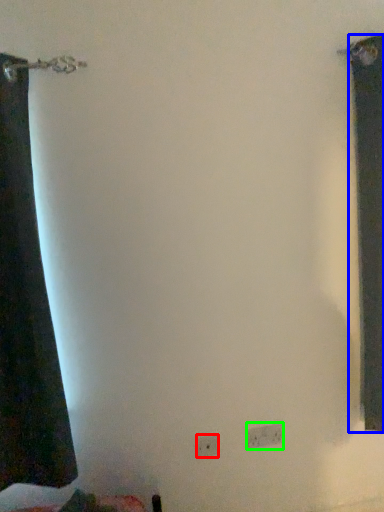
Question: Based on their relative distances, which object is farther from electric outlet (highlighted by a red box)? Choose from curtain (highlighted by a blue box) and electric outlet (highlighted by a green box).

Choices:
 (A) curtain
 (B) electric outlet

Answer: (A)